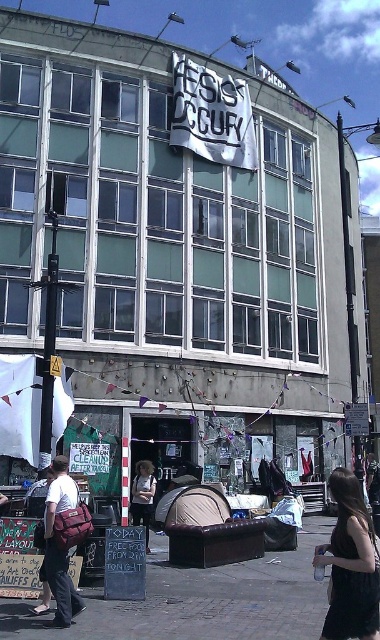
Question: Can you confirm if black dress at lower right is positioned above white cotton shirt at center?

Choices:
 (A) no
 (B) yes

Answer: (A)

Question: Which object is closer to the camera taking this photo?

Choices:
 (A) white cotton shirt at center
 (B) black dress at lower right

Answer: (B)

Question: Is the position of brick pavement at center less distant than that of black dress at lower right?

Choices:
 (A) no
 (B) yes

Answer: (A)

Question: Observing the image, what is the correct spatial positioning of brick pavement at center in reference to white cotton shirt at center?

Choices:
 (A) below
 (B) above

Answer: (A)

Question: Which of these objects is positioned farthest from the black dress at lower right?

Choices:
 (A) white cotton shirt at center
 (B) brick pavement at center

Answer: (A)

Question: Among these objects, which one is nearest to the camera?

Choices:
 (A) white cotton shirt at center
 (B) black dress at lower right
 (C) brick pavement at center

Answer: (B)